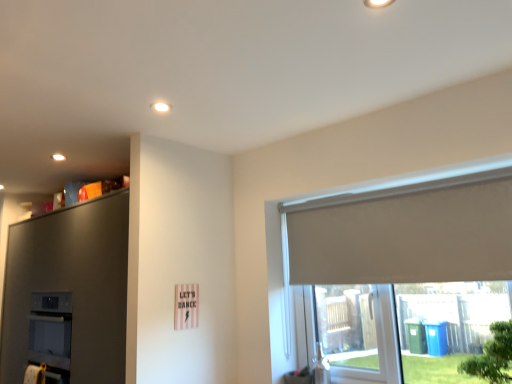
What do you see at coordinates (408, 257) in the screenshot? This screenshot has width=512, height=384. I see `white roller blind at right` at bounding box center [408, 257].

Image resolution: width=512 pixels, height=384 pixels. In order to click on green leafy tree at lower right in this screenshot , I will do `click(492, 355)`.

Is green leafy tree at lower right oriented towards white roller blind at right?

No, green leafy tree at lower right is not oriented towards white roller blind at right.

What's the angular difference between green leafy tree at lower right and white roller blind at right's facing directions?

green leafy tree at lower right and white roller blind at right are facing 0.000175 degrees away from each other.

Could white roller blind at right be considered to be inside green leafy tree at lower right?

Definitely not — white roller blind at right is not inside green leafy tree at lower right.

From the image's perspective, who appears lower, green leafy tree at lower right or white roller blind at right?

green leafy tree at lower right, from the image's perspective.

Is green leafy tree at lower right further to the viewer compared to matte gray dresser at upper left?

That is False.

Does green leafy tree at lower right appear on the left side of matte gray dresser at upper left?

In fact, green leafy tree at lower right is to the right of matte gray dresser at upper left.

Are green leafy tree at lower right and matte gray dresser at upper left far apart?

That's right, there is a large distance between green leafy tree at lower right and matte gray dresser at upper left.

Does green leafy tree at lower right contain matte gray dresser at upper left?

No, matte gray dresser at upper left is not surrounded by green leafy tree at lower right.

From the image's perspective, is white roller blind at right on green leafy tree at lower right?

Yes, from the image's perspective, white roller blind at right is above green leafy tree at lower right.

Can you confirm if white roller blind at right is bigger than green leafy tree at lower right?

Yes, white roller blind at right is bigger than green leafy tree at lower right.

Is white roller blind at right touching green leafy tree at lower right?

No, white roller blind at right is not beside green leafy tree at lower right.

From the picture: Considering the sizes of objects white roller blind at right and green leafy tree at lower right in the image provided, who is shorter, white roller blind at right or green leafy tree at lower right?

green leafy tree at lower right is shorter.

Which point is more distant from viewer, (364, 283) or (37, 361)?

Positioned behind is point (37, 361).

From the image's perspective, which one is positioned higher, white roller blind at right or matte gray dresser at upper left?

white roller blind at right.

From the picture: Could you tell me if white roller blind at right is turned towards matte gray dresser at upper left?

No, white roller blind at right does not turn towards matte gray dresser at upper left.

Considering the relative positions of matte gray dresser at upper left and white roller blind at right in the image provided, is matte gray dresser at upper left to the left or to the right of white roller blind at right?

Based on their positions, matte gray dresser at upper left is located to the left of white roller blind at right.

Measure the distance between matte gray dresser at upper left and white roller blind at right.

matte gray dresser at upper left and white roller blind at right are 1.33 meters apart from each other.

From a real-world perspective, relative to white roller blind at right, is matte gray dresser at upper left vertically above or below?

From a real-world perspective, matte gray dresser at upper left is physically below white roller blind at right.

Looking at this image, is matte gray dresser at upper left bigger than white roller blind at right?

Correct, matte gray dresser at upper left is larger in size than white roller blind at right.

Image resolution: width=512 pixels, height=384 pixels. In order to click on dresser on the left of green leafy tree at lower right in this screenshot , I will do `click(68, 293)`.

Would you say matte gray dresser at upper left is outside green leafy tree at lower right?

Yes.

How distant is matte gray dresser at upper left from green leafy tree at lower right?

matte gray dresser at upper left and green leafy tree at lower right are 2.03 meters apart from each other.

Relative to green leafy tree at lower right, is matte gray dresser at upper left in front or behind?

matte gray dresser at upper left is behind green leafy tree at lower right.

Find the location of a particular element. window above the green leafy tree at lower right (from the image's perspective) is located at coordinates (408, 257).

What are the coordinates of `dresser behind the green leafy tree at lower right` in the screenshot? It's located at (68, 293).

Estimate the real-world distances between objects in this image. Which object is further from green leafy tree at lower right, white roller blind at right or matte gray dresser at upper left?

matte gray dresser at upper left.

Which object lies further to the anchor point matte gray dresser at upper left, white roller blind at right or green leafy tree at lower right?

green leafy tree at lower right is positioned further to the anchor matte gray dresser at upper left.

Which object lies further to the anchor point matte gray dresser at upper left, green leafy tree at lower right or white roller blind at right?

Among the two, green leafy tree at lower right is located further to matte gray dresser at upper left.

From the image, which object appears to be farther from green leafy tree at lower right, matte gray dresser at upper left or white roller blind at right?

The object further to green leafy tree at lower right is matte gray dresser at upper left.

Consider the image. When comparing their distances from white roller blind at right, does green leafy tree at lower right or matte gray dresser at upper left seem further?

matte gray dresser at upper left lies further to white roller blind at right than the other object.

Which object lies further to the anchor point white roller blind at right, matte gray dresser at upper left or green leafy tree at lower right?

matte gray dresser at upper left lies further to white roller blind at right than the other object.

Where is `window between matte gray dresser at upper left and green leafy tree at lower right`? window between matte gray dresser at upper left and green leafy tree at lower right is located at coordinates (408, 257).